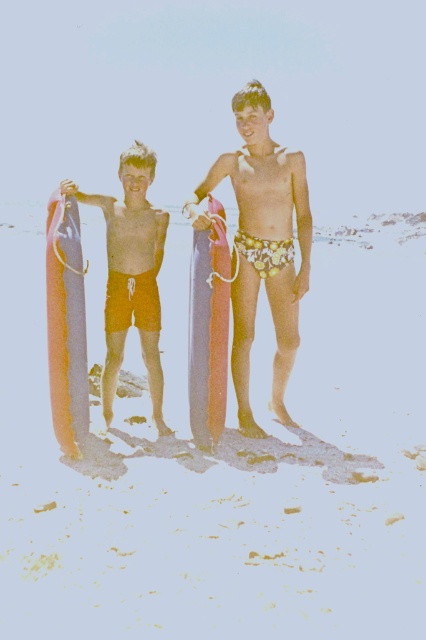
Question: Considering the real-world distances, which object is closest to the smooth purple surfboard at center?

Choices:
 (A) floral swim trunks at center
 (B) orange matte shorts at left

Answer: (B)

Question: Is the position of translucent plastic surfboard at left less distant than that of smooth pink surfboard at center?

Choices:
 (A) no
 (B) yes

Answer: (B)

Question: Can you confirm if orange matte shorts at left is thinner than smooth pink surfboard at center?

Choices:
 (A) yes
 (B) no

Answer: (B)

Question: Can you confirm if smooth purple surfboard at center is positioned to the left of orange matte shorts at left?

Choices:
 (A) no
 (B) yes

Answer: (A)

Question: Estimate the real-world distances between objects in this image. Which object is closer to the smooth purple surfboard at center?

Choices:
 (A) smooth pink surfboard at center
 (B) floral swim trunks at center
 (C) translucent plastic surfboard at left

Answer: (B)

Question: Which object appears closest to the camera in this image?

Choices:
 (A) smooth purple surfboard at center
 (B) orange matte shorts at left
 (C) smooth pink surfboard at center

Answer: (A)